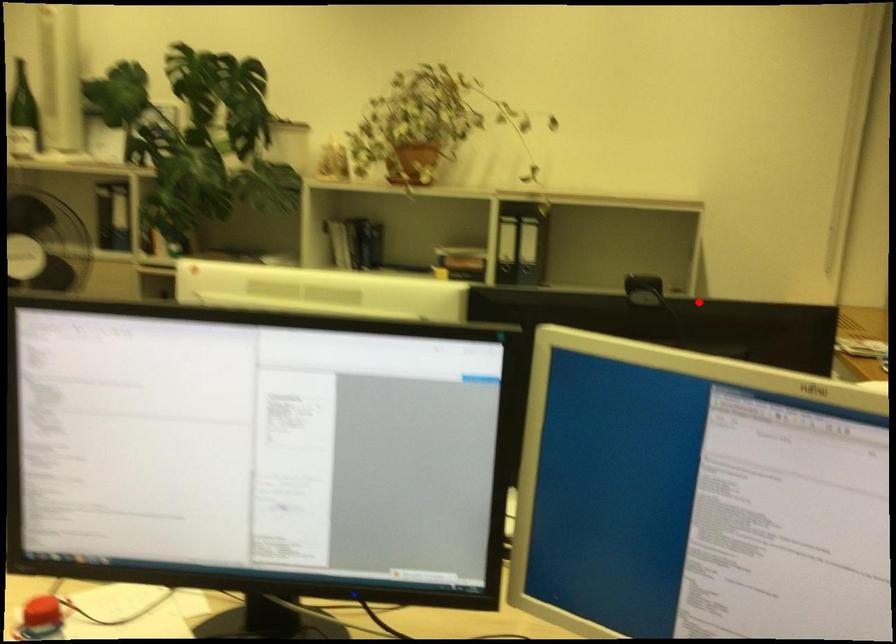
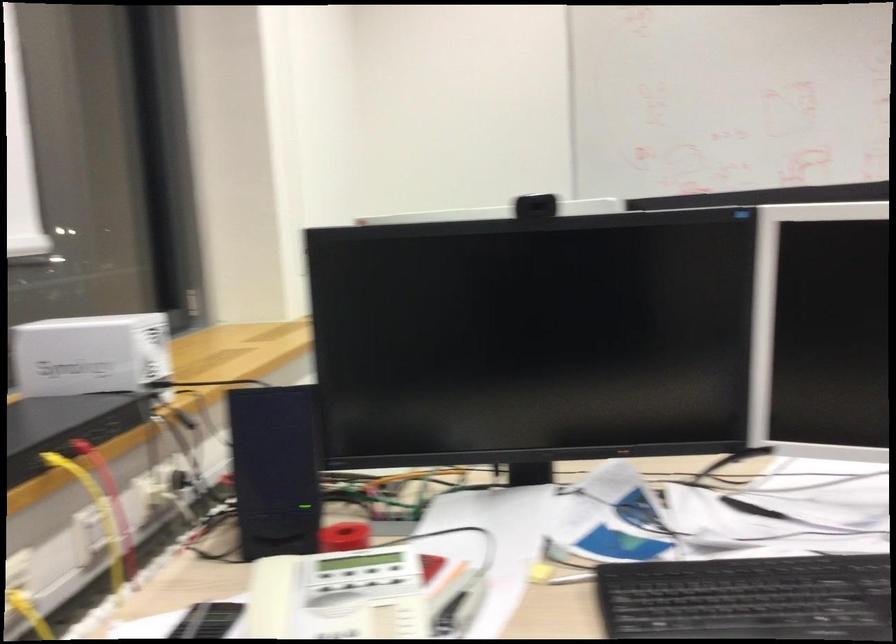
Question: I am providing you with two images of the same scene from different viewpoints. Given a red point in image1, look at the same physical point in image2. Is it:

Choices:
 (A) Closer to the viewpoint
 (B) Farther from the viewpoint

Answer: (A)